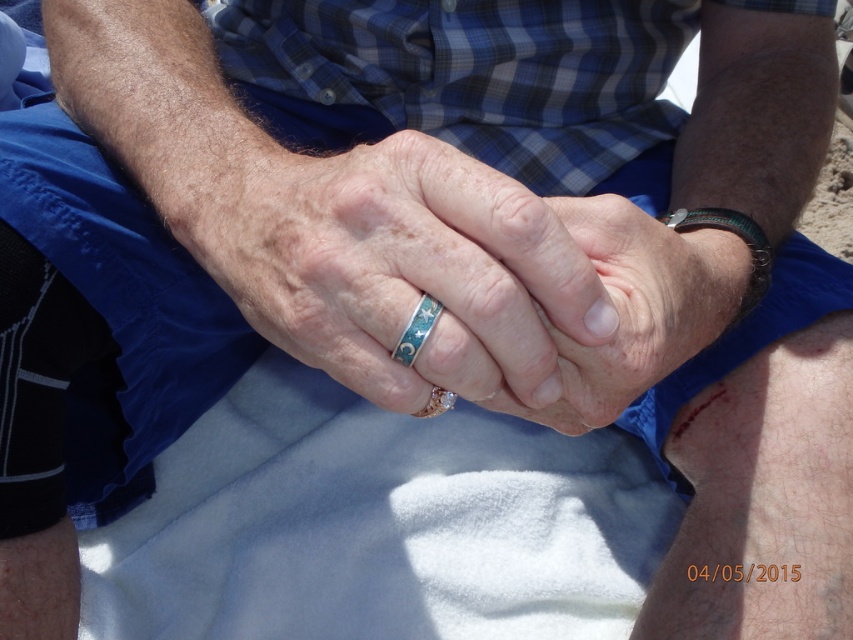
Question: Which of the following is the closest to the observer?

Choices:
 (A) (735, 250)
 (B) (407, 355)
 (C) (701, 225)
 (D) (364, 198)

Answer: (B)

Question: Can you confirm if turquoise glossy ring at center is positioned to the right of green enamel ring at center?

Choices:
 (A) no
 (B) yes

Answer: (B)

Question: Which point is farther to the camera?

Choices:
 (A) (691, 266)
 (B) (410, 330)

Answer: (A)

Question: Is turquoise metallic ring at center bigger than green leather bracelet at upper right?

Choices:
 (A) yes
 (B) no

Answer: (A)

Question: Can you confirm if turquoise metallic ring at center is wider than turquoise glossy ring at center?

Choices:
 (A) no
 (B) yes

Answer: (B)

Question: Which point is closer to the camera?

Choices:
 (A) (683, 212)
 (B) (431, 316)
 (C) (682, 262)
 (D) (546, 220)

Answer: (D)